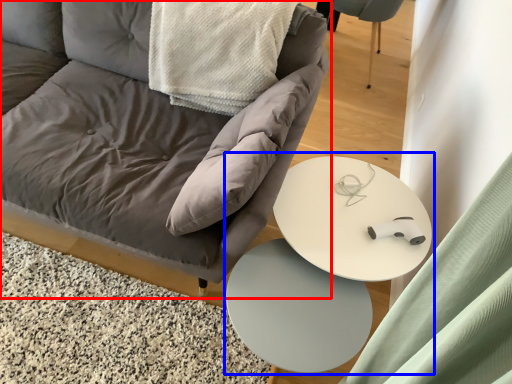
Question: Which object appears farthest to the camera in this image, chair (highlighted by a red box) or round table (highlighted by a blue box)?

Choices:
 (A) chair
 (B) round table

Answer: (B)